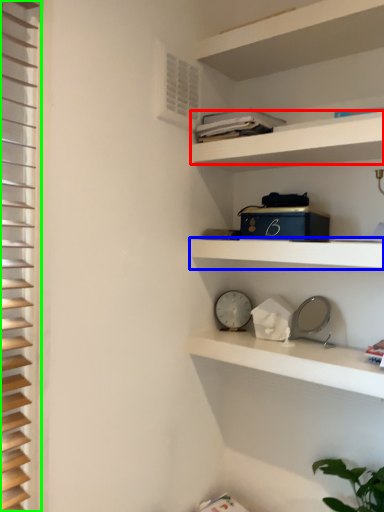
Question: Which object is the closest to the cabinet (highlighted by a red box)? Choose among these: shelf (highlighted by a blue box) or shutter (highlighted by a green box).

Choices:
 (A) shelf
 (B) shutter

Answer: (A)